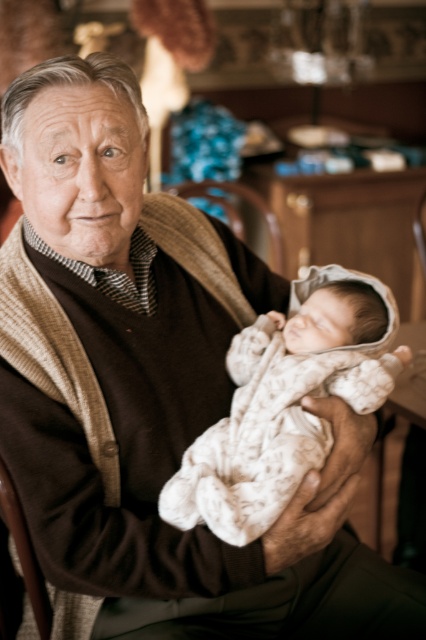
Is white textured fabric at center below brown leather chair at center?

Correct, white textured fabric at center is located below brown leather chair at center.

Find the location of a particular element. The height and width of the screenshot is (640, 426). white textured fabric at center is located at coordinates (285, 403).